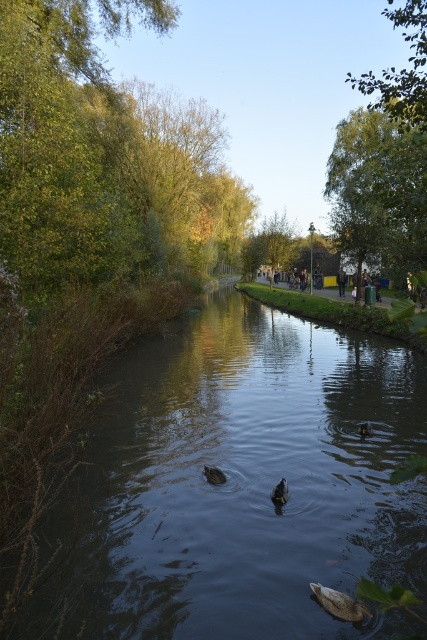
You are an observer standing on the path next to the canal. You notice two items at the center of the scene, the dark blue jeans at center and the light brown leather jacket at center. Which item appears taller in the scene?

The light brown leather jacket at center appears taller than the dark blue jeans at center because the dark blue jeans at center has a lesser height compared to light brown leather jacket at center.

You are standing on the path next to the canal and want to take a photo of the brown fuzzy duck at center with the green leafy tree at right in the background. Can you frame the shot so the duck is on the left side of the photo and the tree is on the right side?

Yes, because the green leafy tree at right is to the right of the brown fuzzy duck at center, so positioning yourself so the duck is on the left and the tree on the right will naturally frame them as described.